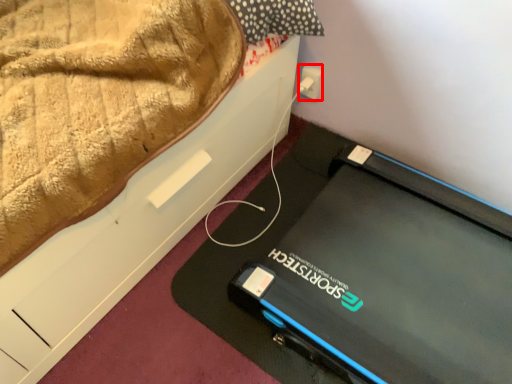
Question: Considering the relative positions of electric outlet (annotated by the red box) and furniture in the image provided, where is electric outlet (annotated by the red box) located with respect to the staircase?

Choices:
 (A) left
 (B) right

Answer: (B)